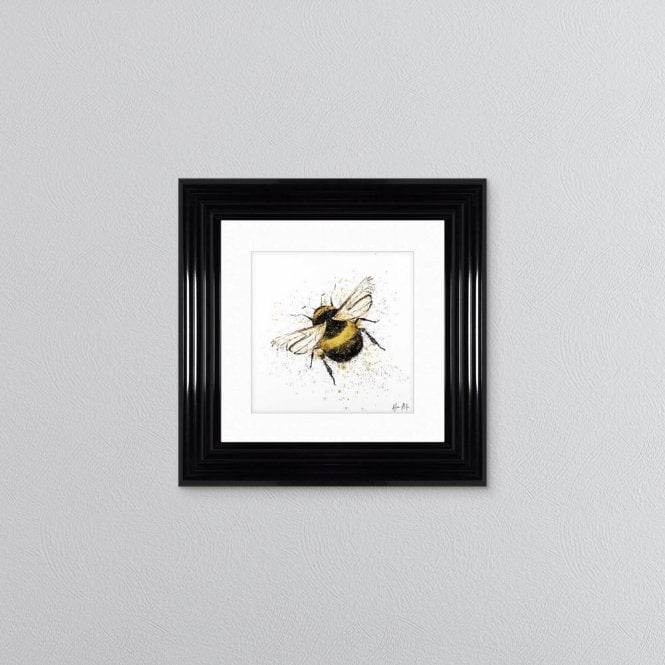
The image size is (665, 665). Find the location of `white wall`. white wall is located at coordinates (136, 356).